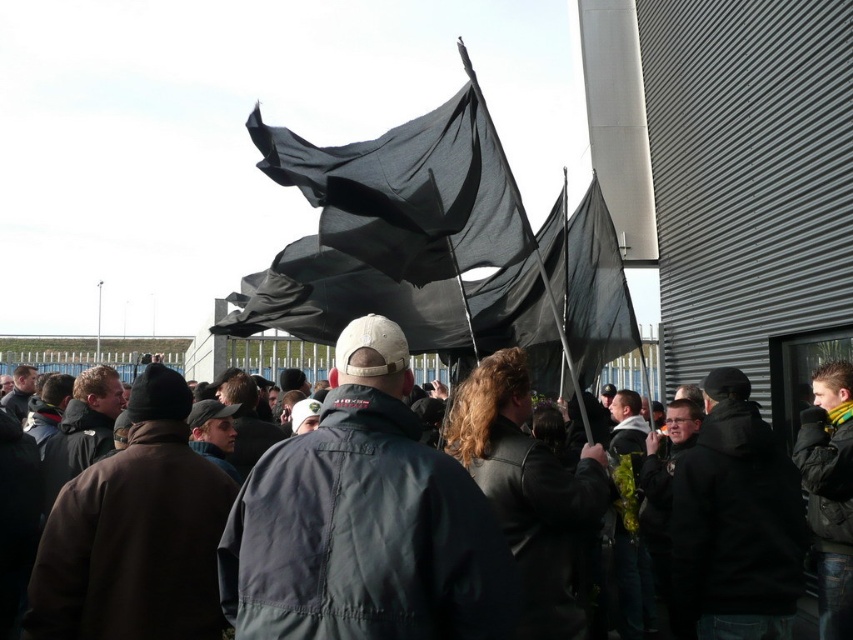
Question: Which of the following is the farthest from the observer?

Choices:
 (A) (425, 515)
 (B) (746, 532)
 (C) (467, 141)

Answer: (C)

Question: Can you confirm if black fabric flag at center is positioned to the right of black fabric flags at center?

Choices:
 (A) yes
 (B) no

Answer: (B)

Question: Does dark gray jacket at center appear on the right side of black fabric flags at center?

Choices:
 (A) no
 (B) yes

Answer: (A)

Question: Does dark gray jacket at center come behind black fabric flags at center?

Choices:
 (A) no
 (B) yes

Answer: (A)

Question: Which point is farther from the camera taking this photo?

Choices:
 (A) (352, 388)
 (B) (445, 198)
 (C) (692, 502)

Answer: (B)

Question: Which is nearer to the black fabric flag at center?

Choices:
 (A) dark gray jacket at center
 (B) black fabric flags at center

Answer: (A)